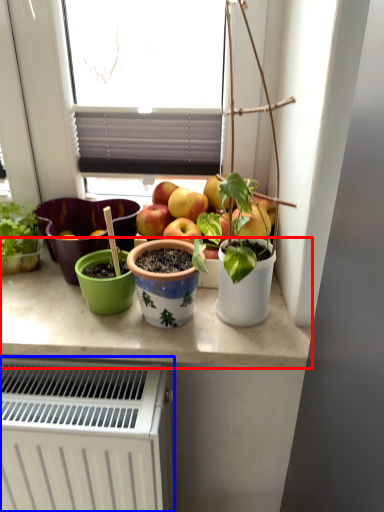
Question: Which object is closer to the camera taking this photo, counter top (highlighted by a red box) or radiator (highlighted by a blue box)?

Choices:
 (A) counter top
 (B) radiator

Answer: (B)